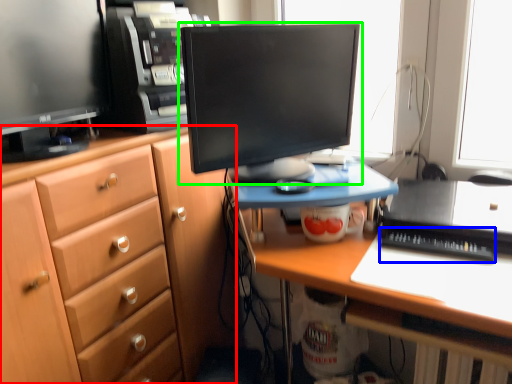
Question: Which object is positioned farthest from cabinetry (highlighted by a red box)? Select from laptop keyboard (highlighted by a blue box) and computer monitor (highlighted by a green box).

Choices:
 (A) laptop keyboard
 (B) computer monitor

Answer: (A)